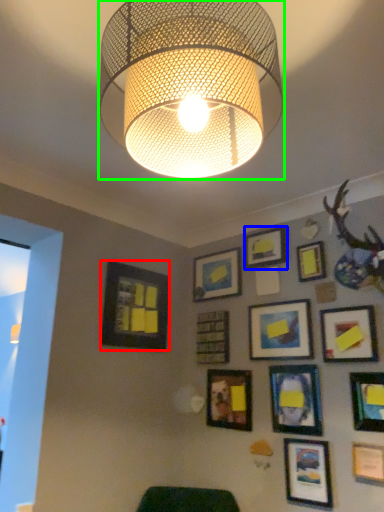
Question: Estimate the real-world distances between objects in this image. Which object is farther from picture frame (highlighted by a red box), picture frame (highlighted by a blue box) or lamp (highlighted by a green box)?

Choices:
 (A) picture frame
 (B) lamp

Answer: (B)